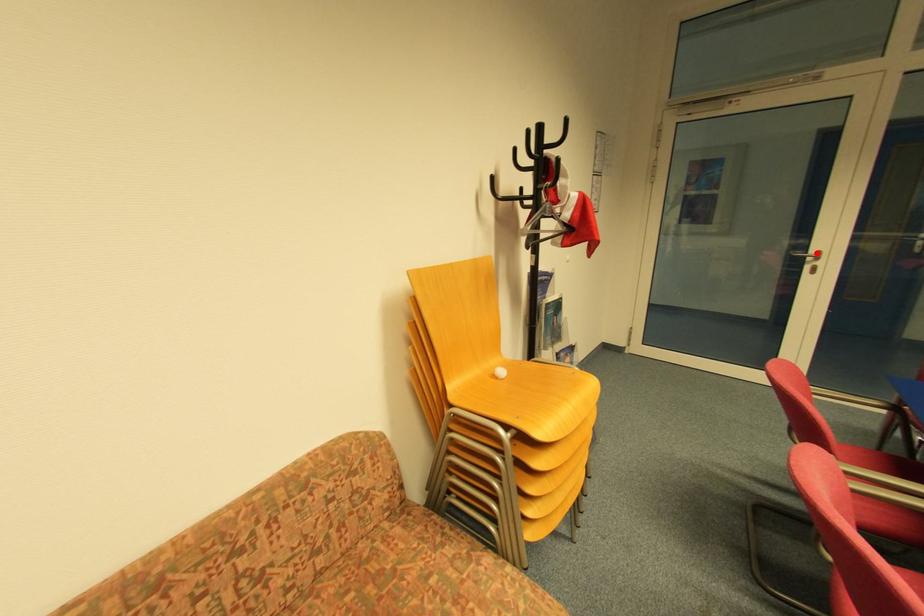
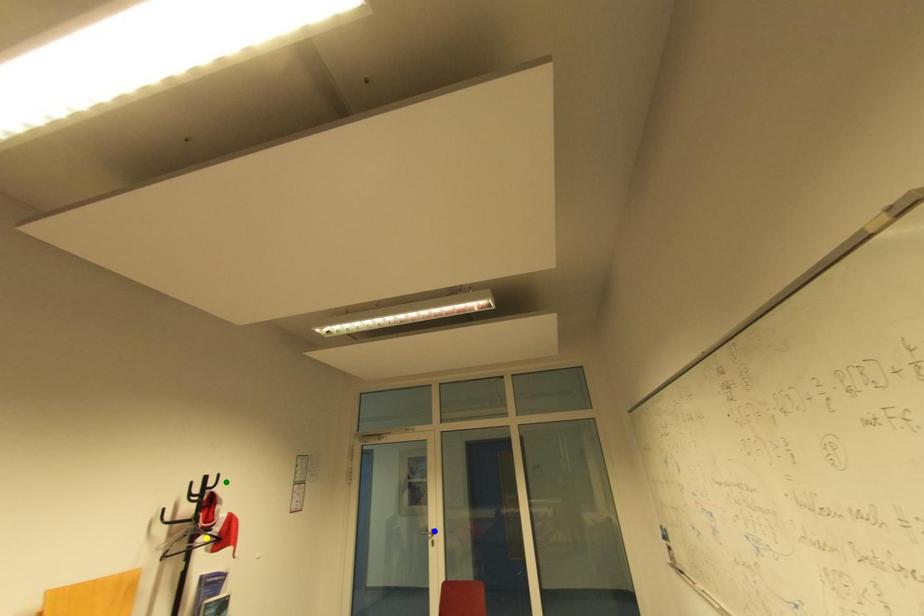
Question: I am providing you with two images of the same scene from different viewpoints. A red point is marked on the first image. You are given multiple points on the second image. Which point in image 2 is actually the same real-world point as the red point in image 1?

Choices:
 (A) yellow point
 (B) green point
 (C) blue point

Answer: (C)